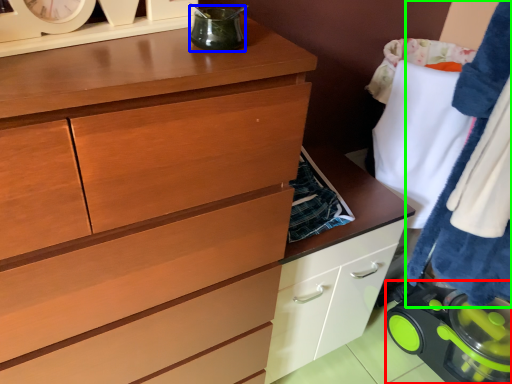
Question: Estimate the real-world distances between objects in this image. Which object is closer to appliance (highlighted by a red box), appliance (highlighted by a blue box) or clothing (highlighted by a green box)?

Choices:
 (A) appliance
 (B) clothing

Answer: (B)